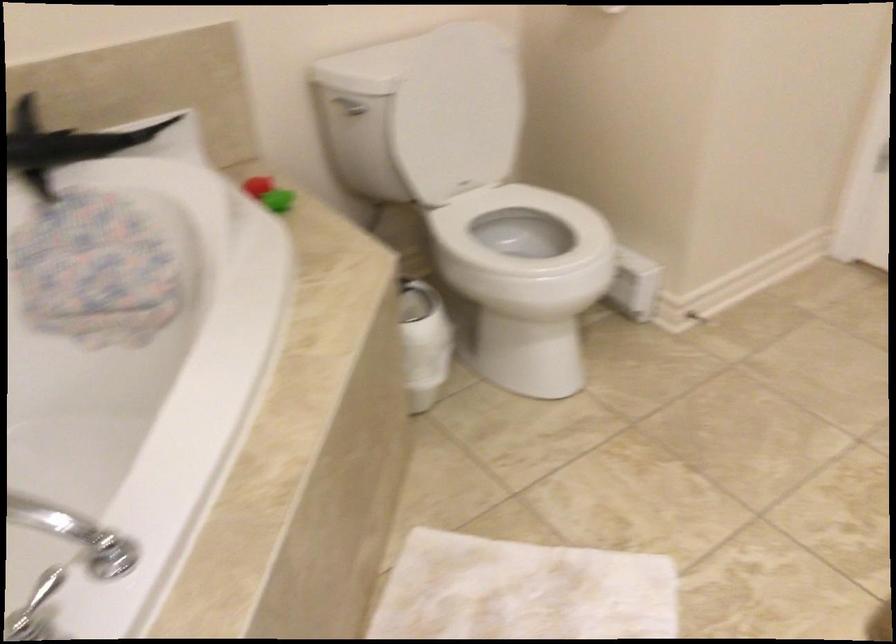
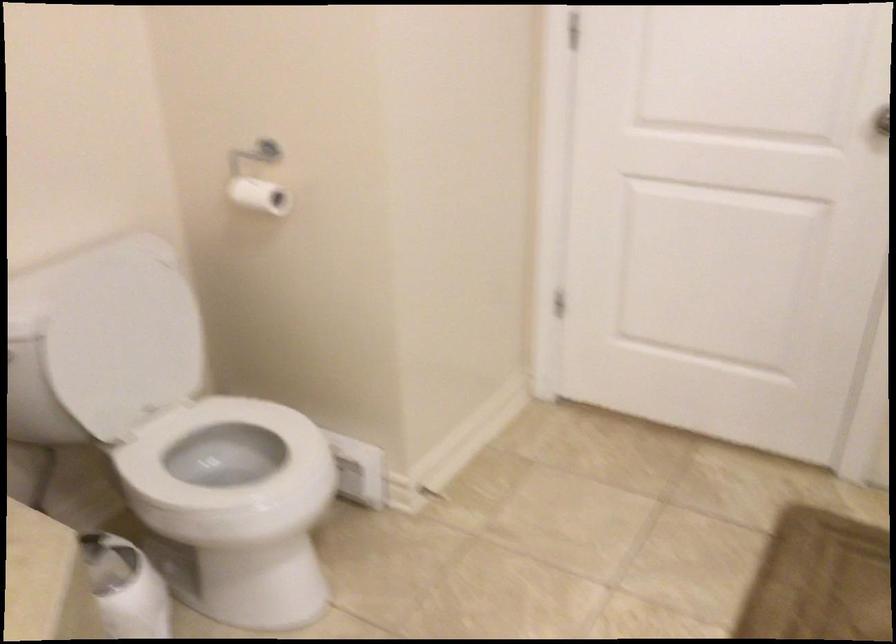
Where in the second image is the point corresponding to the point at 419,317 from the first image?

(125, 587)